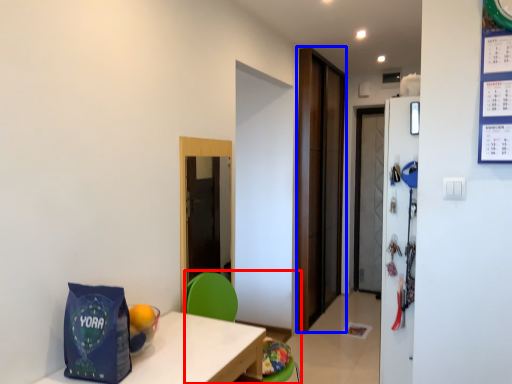
Question: Which point is closer to the camera, armchair (highlighted by a red box) or door (highlighted by a blue box)?

Choices:
 (A) armchair
 (B) door

Answer: (A)